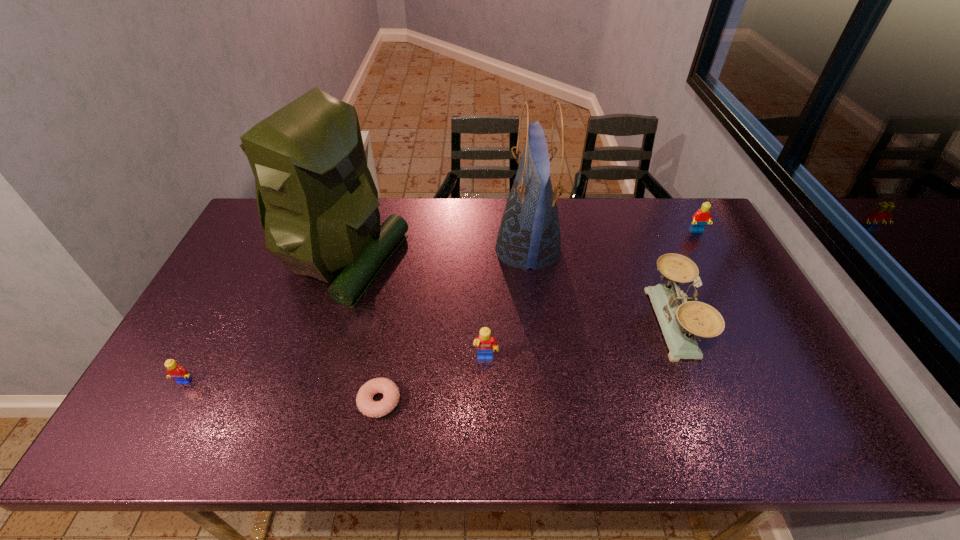
Locate an element on the screen. The image size is (960, 540). backpack is located at coordinates (318, 204).

Where is `shopping bag`? shopping bag is located at coordinates (529, 236).

This screenshot has width=960, height=540. I want to click on the sixth object from left to right, so click(x=680, y=322).

Locate an element on the screen. The height and width of the screenshot is (540, 960). the fifth shortest object is located at coordinates (680, 322).

Where is `the farthest Lego`? The width and height of the screenshot is (960, 540). the farthest Lego is located at coordinates (700, 218).

Image resolution: width=960 pixels, height=540 pixels. What are the coordinates of `the rightmost Lego` in the screenshot? It's located at pos(700,218).

Locate an element on the screen. the second nearest Lego is located at coordinates (486, 344).

Find the location of a particular element. Image resolution: width=960 pixels, height=540 pixels. the second Lego from left to right is located at coordinates (486, 344).

Where is `the nearest Lego`? the nearest Lego is located at coordinates pos(174,370).

This screenshot has height=540, width=960. In order to click on the leftmost Lego in this screenshot , I will do point(174,370).